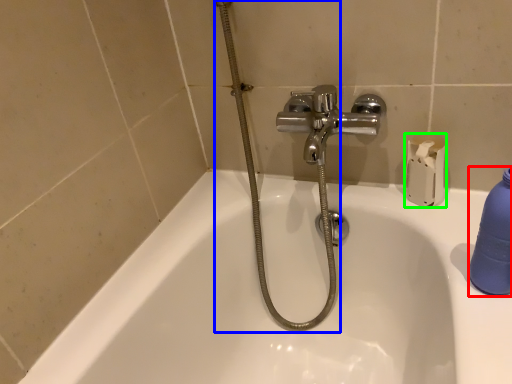
Question: Considering the real-world distances, which object is closest to cleaning product (highlighted by a red box)? shower (highlighted by a blue box) or toilet paper (highlighted by a green box).

Choices:
 (A) shower
 (B) toilet paper

Answer: (B)